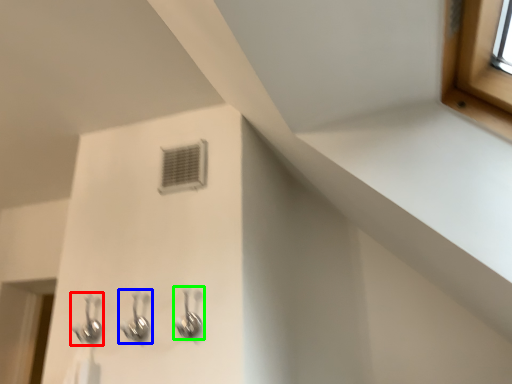
Question: Which object is the farthest from plumbing fixture (highlighted by a red box)? Choose among these: plumbing fixture (highlighted by a blue box) or plumbing fixture (highlighted by a green box).

Choices:
 (A) plumbing fixture
 (B) plumbing fixture

Answer: (B)